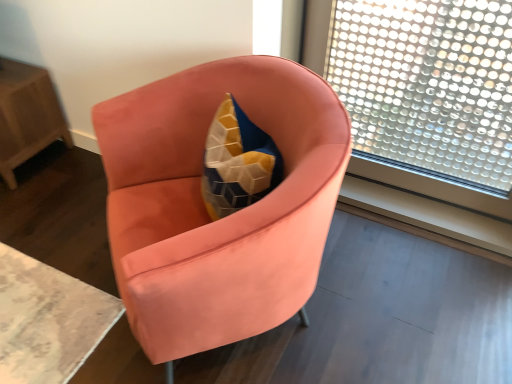
The height and width of the screenshot is (384, 512). What do you see at coordinates (204, 206) in the screenshot?
I see `satin coral armchair at center` at bounding box center [204, 206].

You are a GUI agent. You are given a task and a screenshot of the screen. Output one action in this format:
    pyautogui.click(x=<x>, y=<y>)
    Task: Click on the transparent glass window at upper right
    This screenshot has height=384, width=512.
    Given the screenshot: What is the action you would take?
    pyautogui.click(x=428, y=86)

In the scene shown: Is satin coral armchair at center directly adjacent to transparent glass window at upper right?

No, satin coral armchair at center is not next to transparent glass window at upper right.

Is transparent glass window at upper right a part of satin coral armchair at center?

No.

From a real-world perspective, who is located higher, satin coral armchair at center or transparent glass window at upper right?

transparent glass window at upper right, from a real-world perspective.

How far apart are satin coral armchair at center and transparent glass window at upper right?

satin coral armchair at center is 1.02 meters away from transparent glass window at upper right.

Between wooden table at left and transparent glass window at upper right, which one has less height?

Standing shorter between the two is wooden table at left.

Does point (50, 89) come behind point (373, 5)?

No, it is not.

Is wooden table at left facing towards transparent glass window at upper right?

No, wooden table at left is not oriented towards transparent glass window at upper right.

From a real-world perspective, which is physically below, transparent glass window at upper right or wooden table at left?

wooden table at left.

Looking at this image, is transparent glass window at upper right with wooden table at left?

transparent glass window at upper right is not next to wooden table at left, and they're not touching.

Considering the sizes of objects transparent glass window at upper right and wooden table at left in the image provided, who is bigger, transparent glass window at upper right or wooden table at left?

Bigger between the two is wooden table at left.

At what (x,y) coordinates should I click in order to perform the action: click on chair that appears in front of the transparent glass window at upper right. Please return your answer as a coordinate pair (x, y). This screenshot has width=512, height=384. Looking at the image, I should click on click(x=204, y=206).

Can you tell me how much transparent glass window at upper right and satin coral armchair at center differ in facing direction?

transparent glass window at upper right and satin coral armchair at center are facing 43.1 degrees away from each other.

Is there a large distance between transparent glass window at upper right and satin coral armchair at center?

transparent glass window at upper right is far away from satin coral armchair at center.

Is the surface of wooden table at left in direct contact with satin coral armchair at center?

No, wooden table at left is not with satin coral armchair at center.

Identify the location of table that is under the satin coral armchair at center (from a real-world perspective). (27, 116).

Is wooden table at left positioned beyond the bounds of satin coral armchair at center?

Yes.

Is wooden table at left wider than satin coral armchair at center?

Incorrect, the width of wooden table at left does not surpass that of satin coral armchair at center.

From a real-world perspective, who is located lower, satin coral armchair at center or wooden table at left?

wooden table at left is physically lower.

Is satin coral armchair at center directly adjacent to wooden table at left?

No, satin coral armchair at center is not making contact with wooden table at left.

Does satin coral armchair at center turn towards wooden table at left?

No.

Does satin coral armchair at center have a lesser width compared to wooden table at left?

Incorrect, the width of satin coral armchair at center is not less than that of wooden table at left.

Where is `chair lying on the left of transparent glass window at upper right`? This screenshot has width=512, height=384. chair lying on the left of transparent glass window at upper right is located at coordinates tap(204, 206).

You are a GUI agent. You are given a task and a screenshot of the screen. Output one action in this format:
    pyautogui.click(x=<x>, y=<y>)
    Task: Click on the window in front of the wooden table at left
    The height and width of the screenshot is (384, 512).
    Given the screenshot: What is the action you would take?
    pyautogui.click(x=428, y=86)

Considering their positions, is wooden table at left positioned further to satin coral armchair at center than transparent glass window at upper right?

Based on the image, wooden table at left appears to be further to satin coral armchair at center.

Looking at the image, which one is located further to satin coral armchair at center, transparent glass window at upper right or wooden table at left?

wooden table at left is further to satin coral armchair at center.

From the image, which object appears to be farther from wooden table at left, transparent glass window at upper right or satin coral armchair at center?

Based on the image, transparent glass window at upper right appears to be further to wooden table at left.

Based on their spatial positions, is satin coral armchair at center or wooden table at left closer to transparent glass window at upper right?

satin coral armchair at center.

Consider the image. Based on their spatial positions, is satin coral armchair at center or transparent glass window at upper right closer to wooden table at left?

satin coral armchair at center.

Which object lies nearer to the anchor point transparent glass window at upper right, wooden table at left or satin coral armchair at center?

satin coral armchair at center.

Image resolution: width=512 pixels, height=384 pixels. Identify the location of chair between wooden table at left and transparent glass window at upper right. (204, 206).